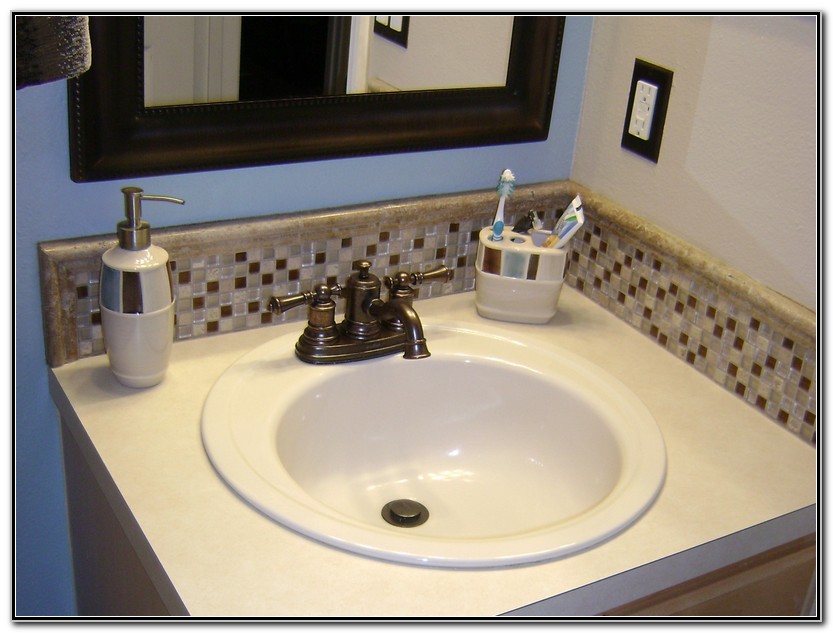
Identify the location of white blue and brown soap container. The width and height of the screenshot is (833, 633). (143, 299).